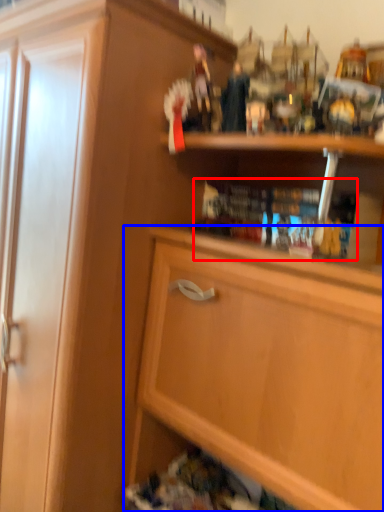
Question: Which object appears closest to the camera in this image, book (highlighted by a red box) or cabinetry (highlighted by a blue box)?

Choices:
 (A) book
 (B) cabinetry

Answer: (B)